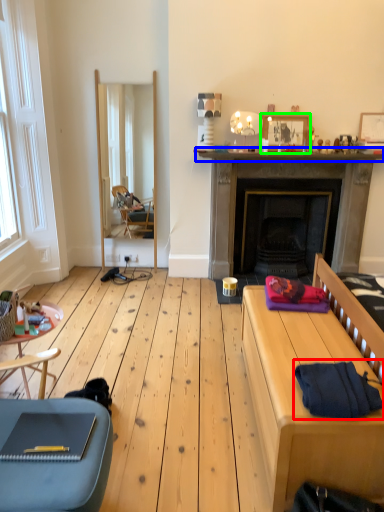
Question: Based on their relative distances, which object is farther from clothing (highlighted by a red box)? Choose from mantle (highlighted by a blue box) and picture frame (highlighted by a green box).

Choices:
 (A) mantle
 (B) picture frame

Answer: (B)